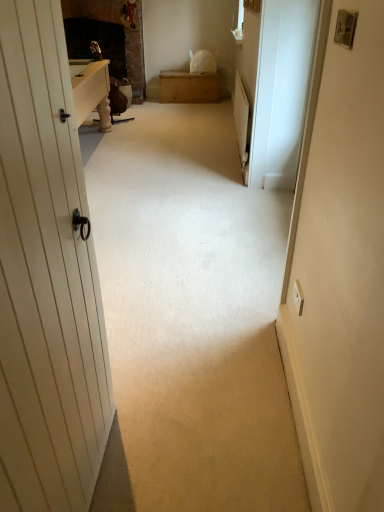
At what (x,y) coordinates should I click in order to perform the action: click on wooden chest at center. Please return your answer as a coordinate pair (x, y). Image resolution: width=384 pixels, height=512 pixels. Looking at the image, I should click on (189, 87).

Locate an element on the screen. The image size is (384, 512). metallic silver lock at upper right is located at coordinates (345, 28).

Locate an element on the screen. white glossy screen door at right is located at coordinates (281, 91).

Is metallic silver lock at upper right aimed at wooden chest at center?

No, metallic silver lock at upper right is not oriented towards wooden chest at center.

Considering the sizes of metallic silver lock at upper right and wooden chest at center in the image, is metallic silver lock at upper right wider or thinner than wooden chest at center?

In the image, metallic silver lock at upper right appears to be more narrow than wooden chest at center.

From the image's perspective, does metallic silver lock at upper right appear higher than wooden chest at center?

No, from the image's perspective, metallic silver lock at upper right is not on top of wooden chest at center.

Considering the relative sizes of metallic silver lock at upper right and wooden chest at center in the image provided, is metallic silver lock at upper right bigger than wooden chest at center?

Actually, metallic silver lock at upper right might be smaller than wooden chest at center.

Does wooden chest at center turn towards white glossy screen door at right?

Yes, wooden chest at center is facing white glossy screen door at right.

What's the angular difference between wooden chest at center and white glossy screen door at right's facing directions?

wooden chest at center and white glossy screen door at right are facing 92.7 degrees away from each other.

Who is bigger, wooden chest at center or white glossy screen door at right?

With larger size is wooden chest at center.

How far apart are wooden chest at center and white glossy screen door at right?

They are 9.41 feet apart.

Looking at this image, from a real-world perspective, is white glossy screen door at right over metallic silver lock at upper right?

No, from a real-world perspective, white glossy screen door at right is not on top of metallic silver lock at upper right.

Is metallic silver lock at upper right at the back of white glossy screen door at right?

white glossy screen door at right does not have its back to metallic silver lock at upper right.

From the picture: From the image's perspective, between white glossy screen door at right and metallic silver lock at upper right, which one is located above?

From the image's view, white glossy screen door at right is above.

Is white glossy screen door at right in contact with metallic silver lock at upper right?

No, white glossy screen door at right is not in contact with metallic silver lock at upper right.

Can you see white glossy screen door at right touching wooden chest at center?

They are not placed beside each other.

What's the angular difference between white glossy screen door at right and wooden chest at center's facing directions?

The facing directions of white glossy screen door at right and wooden chest at center are 92.7 degrees apart.

Does white glossy screen door at right come in front of wooden chest at center?

Yes, white glossy screen door at right is in front of wooden chest at center.

Locate an element on the screen. The image size is (384, 512). lock on the left of white glossy screen door at right is located at coordinates (345, 28).

Considering the sizes of objects metallic silver lock at upper right and white glossy screen door at right in the image provided, who is wider, metallic silver lock at upper right or white glossy screen door at right?

Wider between the two is white glossy screen door at right.

Is metallic silver lock at upper right taller or shorter than white glossy screen door at right?

Considering their sizes, metallic silver lock at upper right has less height than white glossy screen door at right.

How distant is metallic silver lock at upper right from white glossy screen door at right?

metallic silver lock at upper right is 6.88 feet away from white glossy screen door at right.

Which point is more forward, (175,74) or (342,34)?

The point (342,34) is in front.

Where is `lock on the right of wooden chest at center`? This screenshot has height=512, width=384. lock on the right of wooden chest at center is located at coordinates coord(345,28).

Is wooden chest at center looking in the opposite direction of metallic silver lock at upper right?

No, wooden chest at center is not facing away from metallic silver lock at upper right.

At what (x,y) coordinates should I click in order to perform the action: click on furniture below the metallic silver lock at upper right (from a real-world perspective). Please return your answer as a coordinate pair (x, y). The height and width of the screenshot is (512, 384). Looking at the image, I should click on (189, 87).

The width and height of the screenshot is (384, 512). Identify the location of screen door that appears below the wooden chest at center (from the image's perspective). (281, 91).

Which object lies nearer to the anchor point metallic silver lock at upper right, white glossy screen door at right or wooden chest at center?

Among the two, white glossy screen door at right is located nearer to metallic silver lock at upper right.

Which object lies nearer to the anchor point wooden chest at center, metallic silver lock at upper right or white glossy screen door at right?

white glossy screen door at right is positioned closer to the anchor wooden chest at center.

From the image, which object appears to be nearer to white glossy screen door at right, wooden chest at center or metallic silver lock at upper right?

The object closer to white glossy screen door at right is metallic silver lock at upper right.

Which object lies nearer to the anchor point metallic silver lock at upper right, wooden chest at center or white glossy screen door at right?

white glossy screen door at right lies closer to metallic silver lock at upper right than the other object.

Estimate the real-world distances between objects in this image. Which object is closer to wooden chest at center, white glossy screen door at right or metallic silver lock at upper right?

Among the two, white glossy screen door at right is located nearer to wooden chest at center.

From the picture: From the image, which object appears to be farther from white glossy screen door at right, metallic silver lock at upper right or wooden chest at center?

wooden chest at center.

This screenshot has width=384, height=512. Find the location of `screen door between metallic silver lock at upper right and wooden chest at center in the front-back direction`. screen door between metallic silver lock at upper right and wooden chest at center in the front-back direction is located at coordinates (281, 91).